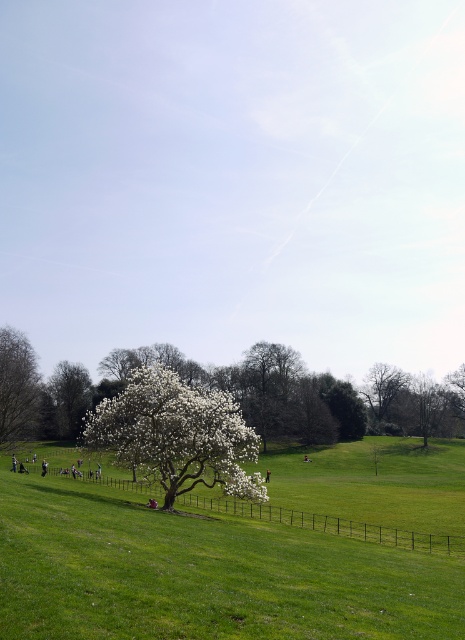
You are a bird flying over the park and want to land on a tree. You see the white textured tree at left and the bare branches tree at upper right. Which tree is positioned higher in the sky?

The white textured tree at left is above the bare branches tree at upper right, so it is positioned higher in the sky.